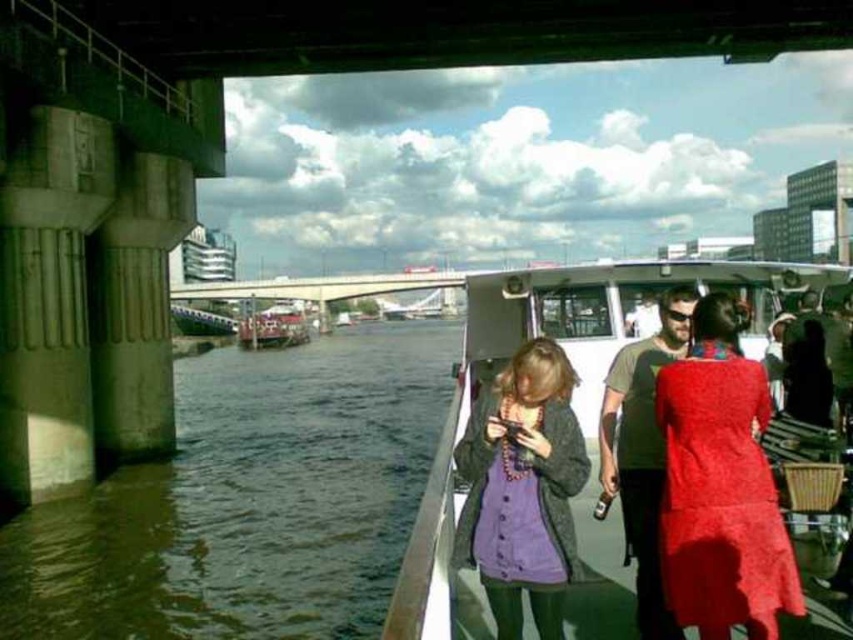
You are standing on the deck of the boat at the point marked by point (576, 417). You want to move to the front of the boat. Which direction should you walk?

The white plastic boat at center is represented by point (576, 417). To move to the front of the boat, you should walk in the direction away from the bridge, as the boat is positioned with its center at this point under the bridge.

You are navigating a small boat and need to avoid the brown murky water at lower left. What coordinates should you steer towards to stay clear of it?

The brown murky water at lower left is located at coordinates point [248,500], so steering towards coordinates opposite to that point would help avoid it.